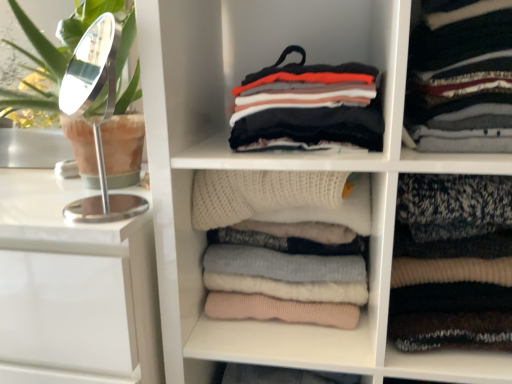
Image resolution: width=512 pixels, height=384 pixels. I want to click on knitted wool sweater at right, which is counted as the third clothing, starting from the left, so click(x=452, y=263).

Locate an element on the screen. The image size is (512, 384). white glossy vanity at left is located at coordinates (75, 283).

This screenshot has height=384, width=512. Describe the element at coordinates (461, 77) in the screenshot. I see `striped knit sweater at upper right, which is the 2th clothing from left to right` at that location.

Locate an element on the screen. The height and width of the screenshot is (384, 512). knit sweater at center is located at coordinates (278, 169).

Is white glossy vanity at left to the right of white knitted sweater at center from the viewer's perspective?

No, white glossy vanity at left is not to the right of white knitted sweater at center.

Between white glossy vanity at left and white knitted sweater at center, which one has larger size?

white glossy vanity at left.

Is white glossy vanity at left taller than white knitted sweater at center?

Yes.

Which is behind, point (69, 193) or point (340, 352)?

The point (69, 193) is behind.

Is knitted wool sweater at right, which is counted as the third clothing, starting from the left, touching white glossy vanity at left?

No, knitted wool sweater at right, which is counted as the third clothing, starting from the left, is not touching white glossy vanity at left.

Considering the relative sizes of knitted wool sweater at right, which is counted as the third clothing, starting from the left, and white glossy vanity at left in the image provided, is knitted wool sweater at right, which is counted as the third clothing, starting from the left, taller than white glossy vanity at left?

No.

How many degrees apart are the facing directions of knitted wool sweater at right, which is counted as the third clothing, starting from the left, and white glossy vanity at left?

1.62 degrees separate the facing orientations of knitted wool sweater at right, which is counted as the third clothing, starting from the left, and white glossy vanity at left.

Considering the relative sizes of multicolored knitted sweater at center, acting as the third clothing starting from the right, and striped knit sweater at upper right, which is the 2th clothing from left to right, in the image provided, is multicolored knitted sweater at center, acting as the third clothing starting from the right, bigger than striped knit sweater at upper right, which is the 2th clothing from left to right,?

Actually, multicolored knitted sweater at center, acting as the third clothing starting from the right, might be smaller than striped knit sweater at upper right, which is the 2th clothing from left to right.

Does multicolored knitted sweater at center, acting as the third clothing starting from the right, have a greater width compared to striped knit sweater at upper right, which is the 2th clothing from left to right?

Correct, the width of multicolored knitted sweater at center, acting as the third clothing starting from the right, exceeds that of striped knit sweater at upper right, which is the 2th clothing from left to right.

Can you tell me how much multicolored knitted sweater at center, positioned as the first clothing in left-to-right order, and striped knit sweater at upper right, which is the 2th clothing from left to right, differ in facing direction?

4.11e-05 degrees.

From a real-world perspective, is knitted wool sweater at right, the 1th clothing in the right-to-left sequence, over multicolored knitted sweater at center, positioned as the first clothing in left-to-right order?

No.

Is point (459, 287) positioned before point (349, 147)?

No, it is behind (349, 147).

Which object is wider, knitted wool sweater at right, which is counted as the third clothing, starting from the left, or multicolored knitted sweater at center, positioned as the first clothing in left-to-right order?

Wider between the two is multicolored knitted sweater at center, positioned as the first clothing in left-to-right order.

Is knitted wool sweater at right, the 1th clothing in the right-to-left sequence, in contact with multicolored knitted sweater at center, positioned as the first clothing in left-to-right order?

No, knitted wool sweater at right, the 1th clothing in the right-to-left sequence, is not making contact with multicolored knitted sweater at center, positioned as the first clothing in left-to-right order.

How different are the orientations of white knitted sweater at center and multicolored knitted sweater at center, acting as the third clothing starting from the right, in degrees?

The facing directions of white knitted sweater at center and multicolored knitted sweater at center, acting as the third clothing starting from the right, are 3.27e-05 degrees apart.

Based on their positions, is white knitted sweater at center located to the left or right of multicolored knitted sweater at center, positioned as the first clothing in left-to-right order?

In the image, white knitted sweater at center appears on the left side of multicolored knitted sweater at center, positioned as the first clothing in left-to-right order.

Does white knitted sweater at center have a larger size compared to multicolored knitted sweater at center, positioned as the first clothing in left-to-right order?

Yes.

From the picture: Considering the relative sizes of white knitted sweater at center and multicolored knitted sweater at center, acting as the third clothing starting from the right, in the image provided, is white knitted sweater at center shorter than multicolored knitted sweater at center, acting as the third clothing starting from the right,?

No, white knitted sweater at center is not shorter than multicolored knitted sweater at center, acting as the third clothing starting from the right.

Which point is more distant from viewer, (480, 292) or (369, 348)?

Positioned behind is point (480, 292).

Between knitted wool sweater at right, the 1th clothing in the right-to-left sequence, and white knitted sweater at center, which one appears on the right side from the viewer's perspective?

knitted wool sweater at right, the 1th clothing in the right-to-left sequence.

From a real-world perspective, is knitted wool sweater at right, which is counted as the third clothing, starting from the left, positioned above or below white knitted sweater at center?

knitted wool sweater at right, which is counted as the third clothing, starting from the left, is above white knitted sweater at center.

Considering their positions, is knitted wool sweater at right, the 1th clothing in the right-to-left sequence, located in front of or behind white knitted sweater at center?

Visually, knitted wool sweater at right, the 1th clothing in the right-to-left sequence, is located in front of white knitted sweater at center.

From a real-world perspective, is knit sweater at center under multicolored knitted sweater at center, acting as the third clothing starting from the right?

Indeed, from a real-world perspective, knit sweater at center is positioned beneath multicolored knitted sweater at center, acting as the third clothing starting from the right.

From the picture: From their relative heights in the image, would you say knit sweater at center is taller or shorter than multicolored knitted sweater at center, positioned as the first clothing in left-to-right order?

Considering their sizes, knit sweater at center has more height than multicolored knitted sweater at center, positioned as the first clothing in left-to-right order.

Consider the image. Is there a large distance between knit sweater at center and multicolored knitted sweater at center, acting as the third clothing starting from the right?

No, knit sweater at center is not far from multicolored knitted sweater at center, acting as the third clothing starting from the right.

Between knit sweater at center and multicolored knitted sweater at center, acting as the third clothing starting from the right, which one has smaller size?

multicolored knitted sweater at center, acting as the third clothing starting from the right, is smaller.

Where is `vanity on the left of the white knitted sweater at center`? The height and width of the screenshot is (384, 512). vanity on the left of the white knitted sweater at center is located at coordinates (75, 283).

The width and height of the screenshot is (512, 384). In order to click on vanity below the knitted wool sweater at right, the 1th clothing in the right-to-left sequence (from the image's perspective) in this screenshot , I will do `click(75, 283)`.

From the image, which object appears to be farther from multicolored knitted sweater at center, positioned as the first clothing in left-to-right order, knit sweater at center or white knitted sweater at center?

The object further to multicolored knitted sweater at center, positioned as the first clothing in left-to-right order, is white knitted sweater at center.

Looking at the image, which one is located further to knitted wool sweater at right, the 1th clothing in the right-to-left sequence, knit sweater at center or multicolored knitted sweater at center, positioned as the first clothing in left-to-right order?

Based on the image, multicolored knitted sweater at center, positioned as the first clothing in left-to-right order, appears to be further to knitted wool sweater at right, the 1th clothing in the right-to-left sequence.

Looking at the image, which one is located further to white knitted sweater at center, striped knit sweater at upper right, which is the 2th clothing from left to right, or multicolored knitted sweater at center, positioned as the first clothing in left-to-right order?

Based on the image, striped knit sweater at upper right, which is the 2th clothing from left to right, appears to be further to white knitted sweater at center.

Which object lies further to the anchor point white glossy vanity at left, striped knit sweater at upper right, which appears as the second clothing when viewed from the right, or multicolored knitted sweater at center, positioned as the first clothing in left-to-right order?

striped knit sweater at upper right, which appears as the second clothing when viewed from the right, lies further to white glossy vanity at left than the other object.

When comparing their distances from multicolored knitted sweater at center, acting as the third clothing starting from the right, does white knitted sweater at center or striped knit sweater at upper right, which is the 2th clothing from left to right, seem closer?

Among the two, striped knit sweater at upper right, which is the 2th clothing from left to right, is located nearer to multicolored knitted sweater at center, acting as the third clothing starting from the right.

From the picture: Estimate the real-world distances between objects in this image. Which object is closer to multicolored knitted sweater at center, positioned as the first clothing in left-to-right order, white glossy vanity at left or striped knit sweater at upper right, which is the 2th clothing from left to right?

Based on the image, striped knit sweater at upper right, which is the 2th clothing from left to right, appears to be nearer to multicolored knitted sweater at center, positioned as the first clothing in left-to-right order.

When comparing their distances from knit sweater at center, does white knitted sweater at center or striped knit sweater at upper right, which appears as the second clothing when viewed from the right, seem closer?

white knitted sweater at center is closer to knit sweater at center.

When comparing their distances from knitted wool sweater at right, which is counted as the third clothing, starting from the left, does multicolored knitted sweater at center, positioned as the first clothing in left-to-right order, or knit sweater at center seem further?

multicolored knitted sweater at center, positioned as the first clothing in left-to-right order.

Identify the location of cabinet between white glossy vanity at left and striped knit sweater at upper right, which is the 2th clothing from left to right. The height and width of the screenshot is (384, 512). (311, 324).

Locate an element on the screen. The image size is (512, 384). cabinet located between white glossy vanity at left and knitted wool sweater at right, the 1th clothing in the right-to-left sequence, in the left-right direction is located at coordinates (311, 324).

This screenshot has width=512, height=384. I want to click on cabinet between striped knit sweater at upper right, which appears as the second clothing when viewed from the right, and knit sweater at center vertically, so click(311, 324).

The width and height of the screenshot is (512, 384). In order to click on cabinet between white glossy vanity at left and knit sweater at center in the horizontal direction in this screenshot , I will do `click(311, 324)`.